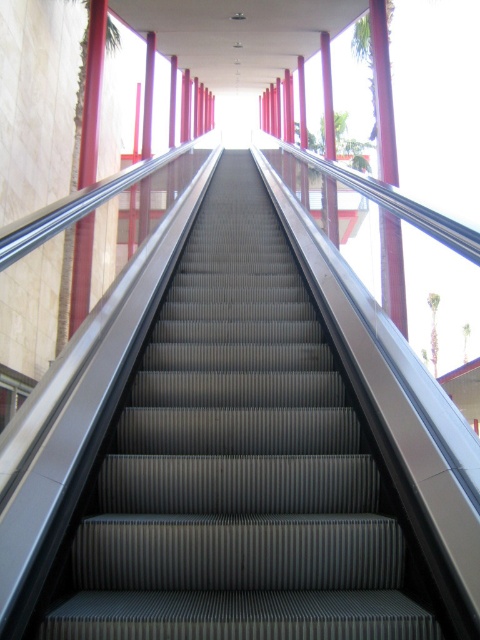
You are standing at the bottom of the escalator and want to reach the top. You notice the metallic gray escalator steps at center and the metallic red pillar at upper center. Which object is closer to you?

The metallic gray escalator steps at center is closer to you since it is smaller than the metallic red pillar at upper center, indicating it is nearer in the scene.

You are standing at the bottom of the escalator and looking upwards. Which object is closer to you, the metallic gray escalator steps at center or the metallic red pillar at upper center?

The metallic gray escalator steps at center is closer to you because it is in front of the metallic red pillar at upper center.

You are standing at the base of the metallic gray escalator steps at center and want to reach the top. If your average walking speed is 1.5 meters per second, how long will it take you to walk up the steps?

The metallic gray escalator steps at center is 2.82 meters away from camera. At a walking speed of 1.5 meters per second, it would take approximately 1.88 seconds to reach the top.